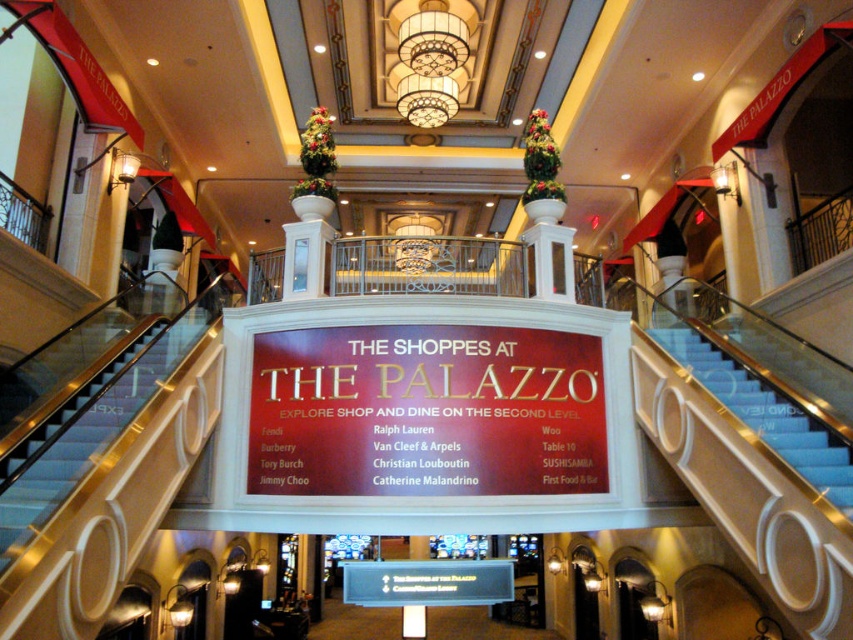
You are a tourist entering the mall and see the shiny gold sign at center and the metallic blue stairs at left. Which object is located to the right of the other?

The shiny gold sign at center is positioned on the right side of metallic blue stairs at left, so the shiny gold sign at center is to the right of the metallic blue stairs at left.

You are a visitor at The Shoppes at The Palazzo and need to reach the second level where the dining options are located. You see two sets of stairs, the metallic blue stairs at left and the blue carpeted stairs at center. Which set of stairs will take you higher?

The metallic blue stairs at left is taller than the blue carpeted stairs at center, so the metallic blue stairs at left will take you higher to the second level where the dining options are located.

In the scene shown: You are a visitor at the mall and want to find the shiny gold sign at center. You see the metallic blue stairs at left. Which object is taller?

The metallic blue stairs at left are taller than the shiny gold sign at center.